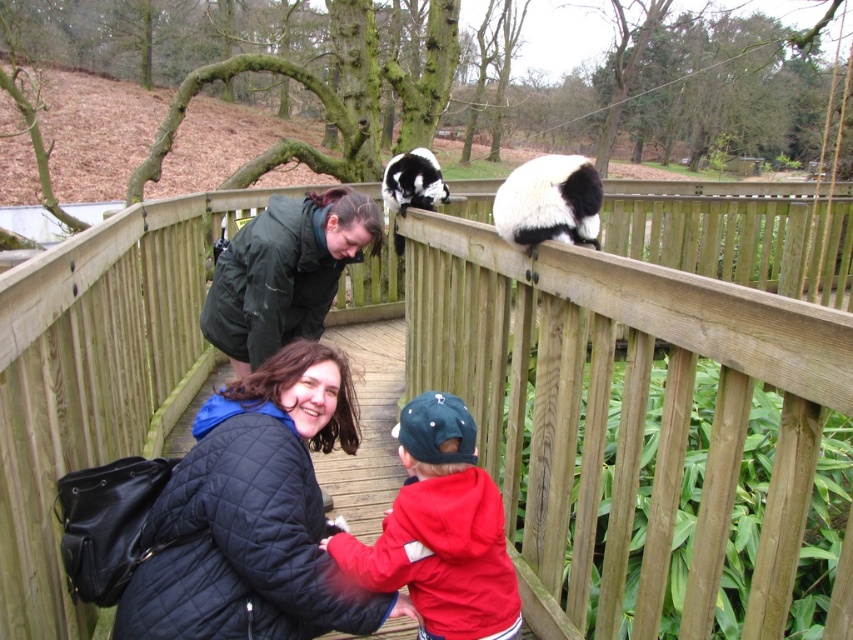
What is the exact 2D coordinate of the red fleece jacket at center?

The exact 2D coordinate of the red fleece jacket at center is at point (x=440, y=531).

You are standing on the wooden walkway and want to approach the black and white fur at upper right. Which direction should you move relative to the quilted black jacket at center?

You should move to the right of the quilted black jacket at center to reach the black and white fur at upper right because the quilted black jacket at center is to the left of black and white fur at upper right.